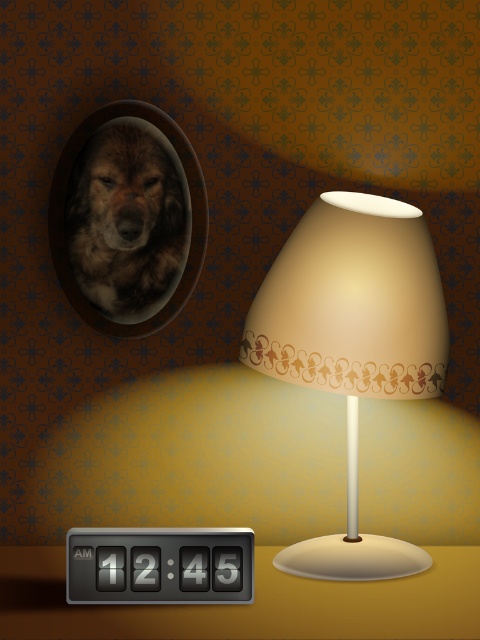
Where is the fuzzy brown dog at upper left located in the image?

The fuzzy brown dog at upper left is located at point (124, 220) in the image.

You are an interior designer planning to hang a new picture. You see the matte beige lampshade at center and the fuzzy brown dog at upper left. Which object is closer to you, and why?

The matte beige lampshade at center is closer to you because it is in front of the fuzzy brown dog at upper left.

You are an interior designer planning to place a small decorative item on the table where the matte beige lampshade at center and the black plastic thermostat at bottom left are located. Which object should you avoid placing the item near to ensure it doesn

You should avoid placing the item near the matte beige lampshade at center because it is larger than the black plastic thermostat at bottom left, so it occupies more space.